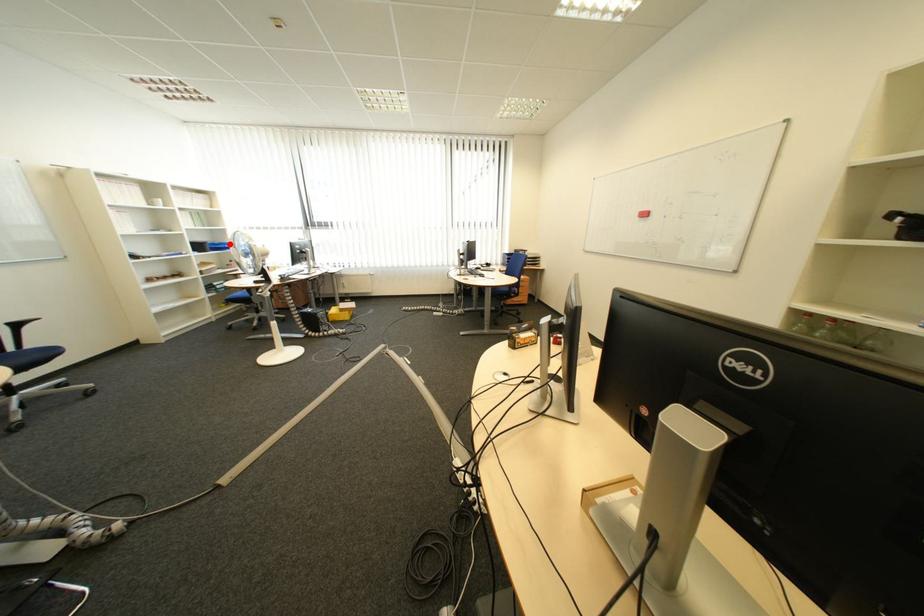
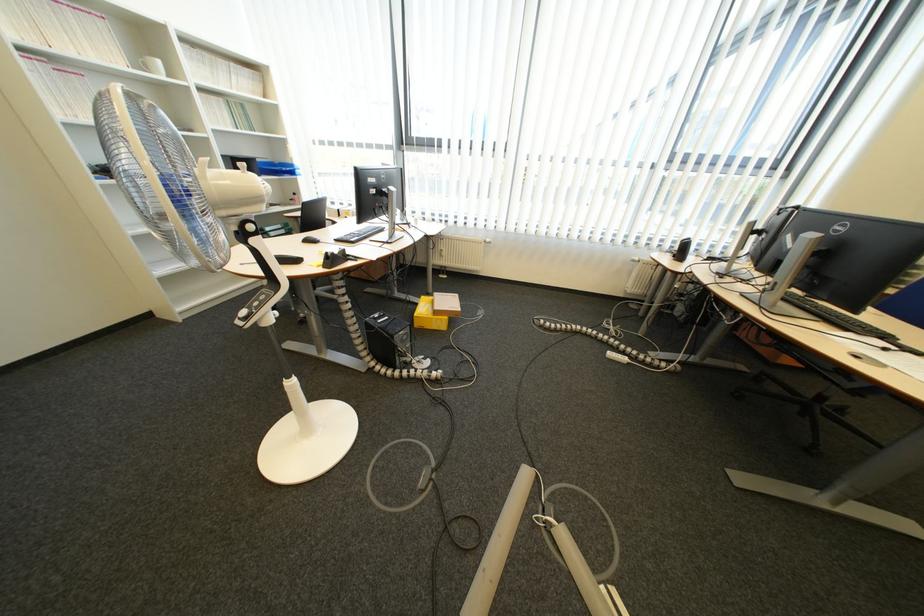
The point at the highlighted location is marked in the first image. Where is the corresponding point in the second image?

(289, 163)